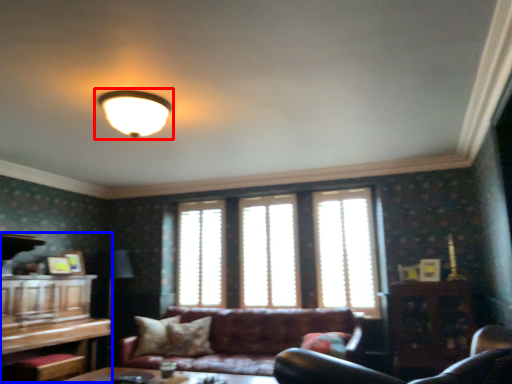
Question: Which object is further to the camera taking this photo, lamp (highlighted by a red box) or entertainment center (highlighted by a blue box)?

Choices:
 (A) lamp
 (B) entertainment center

Answer: (B)